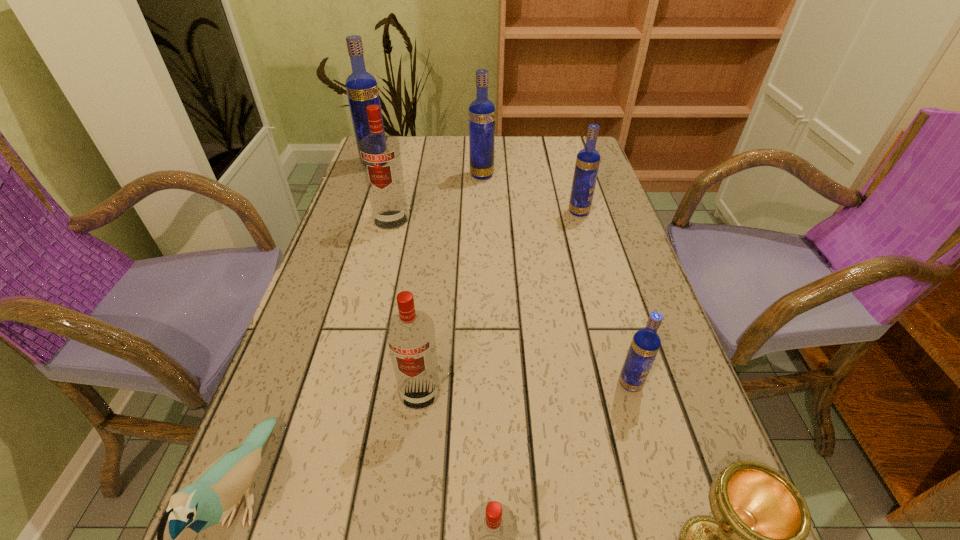
Image resolution: width=960 pixels, height=540 pixels. I want to click on the tallest object, so click(x=362, y=90).

In order to click on the tallest vodka in this screenshot , I will do `click(362, 90)`.

Where is `the third smallest blue vodka`? the third smallest blue vodka is located at coordinates (481, 111).

This screenshot has height=540, width=960. In order to click on the biggest red vodka in this screenshot , I will do `click(380, 154)`.

The image size is (960, 540). Identify the location of the sixth vodka from right to left. (380, 154).

Locate an element on the screen. The height and width of the screenshot is (540, 960). the second smallest blue vodka is located at coordinates (588, 159).

This screenshot has width=960, height=540. Find the location of `the second farthest red vodka`. the second farthest red vodka is located at coordinates (410, 334).

Identify the location of the second red vodka from right to left. This screenshot has height=540, width=960. (410, 334).

Locate an element on the screen. The image size is (960, 540). the nearest blue vodka is located at coordinates (645, 344).

Locate an element on the screen. The image size is (960, 540). free space located 0.090m on the right of the tallest vodka is located at coordinates (418, 163).